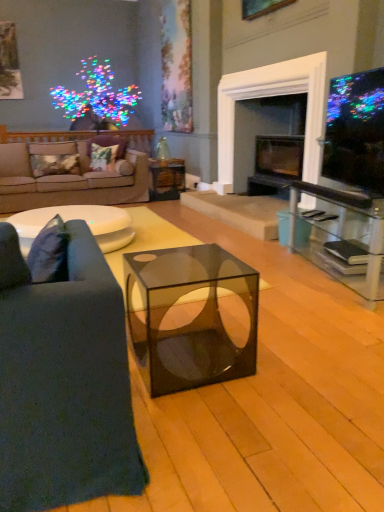
What is the approximate height of floral fabric pillow at center, the first pillow in the right-to-left sequence?

floral fabric pillow at center, the first pillow in the right-to-left sequence, is 14.15 inches in height.

How much space does floral fabric pillow at center, the first pillow in the right-to-left sequence, occupy horizontally?

It is 9.08 inches.

Describe the element at coordinates (269, 144) in the screenshot. I see `black glass fireplace at center` at that location.

Locate an element on the screen. Image resolution: width=384 pixels, height=512 pixels. metallic gold pillow at left, placed as the 3th pillow when sorted from right to left is located at coordinates (54, 159).

Where is `matte black tv at upper right`? matte black tv at upper right is located at coordinates (356, 131).

This screenshot has width=384, height=512. What do you see at coordinates (77, 219) in the screenshot? I see `white glossy coffee table at center` at bounding box center [77, 219].

I want to click on clear glass entertainment center at right, so point(337,234).

Where is `floral fabric pillow at center, the first pillow in the right-to-left sequence`? This screenshot has height=512, width=384. floral fabric pillow at center, the first pillow in the right-to-left sequence is located at coordinates (103, 157).

Visually, is dark blue fabric couch at left, the first studio couch from the right, positioned to the left or to the right of metallic gold pillow at left, placed as the 3th pillow when sorted from right to left?

In the image, dark blue fabric couch at left, the first studio couch from the right, appears on the right side of metallic gold pillow at left, placed as the 3th pillow when sorted from right to left.

Is dark blue fabric couch at left, marked as the 1th studio couch in a front-to-back arrangement, positioned in front of metallic gold pillow at left, placed as the first pillow when sorted from left to right?

Yes, dark blue fabric couch at left, marked as the 1th studio couch in a front-to-back arrangement, is closer to the viewer.

Which object is wider, dark blue fabric couch at left, the 2th studio couch when ordered from top to bottom, or metallic gold pillow at left, placed as the 3th pillow when sorted from right to left?

dark blue fabric couch at left, the 2th studio couch when ordered from top to bottom.

Is metallic gold pillow at left, placed as the 3th pillow when sorted from right to left, at the back of dark blue fabric couch at left, marked as the 1th studio couch in a front-to-back arrangement?

No, dark blue fabric couch at left, marked as the 1th studio couch in a front-to-back arrangement,'s orientation is not away from metallic gold pillow at left, placed as the 3th pillow when sorted from right to left.

Relative to transparent glass cube at center, is matte black tv at upper right in front or behind?

Visually, matte black tv at upper right is located behind transparent glass cube at center.

From the image's perspective, which is above, matte black tv at upper right or transparent glass cube at center?

matte black tv at upper right is shown above in the image.

Is matte black tv at upper right turned away from transparent glass cube at center?

No, matte black tv at upper right's orientation is not away from transparent glass cube at center.

How far apart are matte black tv at upper right and transparent glass cube at center?

A distance of 4.54 feet exists between matte black tv at upper right and transparent glass cube at center.

Is white glossy coffee table at center not within beige fabric couch at left, the 1th studio couch when ordered from top to bottom?

white glossy coffee table at center lies outside beige fabric couch at left, the 1th studio couch when ordered from top to bottom,'s area.

Is white glossy coffee table at center further to the viewer compared to beige fabric couch at left, which ranks as the first studio couch in back-to-front order?

That is False.

Does white glossy coffee table at center have a greater height compared to beige fabric couch at left, which is counted as the 1th studio couch, starting from the left?

In fact, white glossy coffee table at center may be shorter than beige fabric couch at left, which is counted as the 1th studio couch, starting from the left.

What are the coordinates of `table that is below the beige fabric couch at left, which ranks as the first studio couch in back-to-front order (from the image's perspective)` in the screenshot? It's located at (77, 219).

Can you tell me how much dark blue fabric couch at left, arranged as the 1th studio couch when ordered from the bottom, and matte black tv at upper right differ in facing direction?

76.2 degrees separate the facing orientations of dark blue fabric couch at left, arranged as the 1th studio couch when ordered from the bottom, and matte black tv at upper right.

Which of these two, dark blue fabric couch at left, marked as the 1th studio couch in a front-to-back arrangement, or matte black tv at upper right, stands shorter?

matte black tv at upper right.

From a real-world perspective, is dark blue fabric couch at left, the 2th studio couch when ordered from left to right, positioned above or below matte black tv at upper right?

dark blue fabric couch at left, the 2th studio couch when ordered from left to right, is below matte black tv at upper right.

From the image's perspective, who appears lower, dark blue fabric couch at left, the first studio couch from the right, or matte black tv at upper right?

From the image's view, dark blue fabric couch at left, the first studio couch from the right, is below.

I want to click on studio couch that is the 1st object to the left of the black glass fireplace at center, starting at the anchor, so tap(64, 383).

Between black glass fireplace at center and dark blue fabric couch at left, the first studio couch from the right, which one has more height?

Standing taller between the two is black glass fireplace at center.

Which is less distant, (255, 189) or (70, 430)?

The point (70, 430) is in front.

Is dark blue fabric couch at left, the 2th studio couch when ordered from top to bottom, completely or partially inside black glass fireplace at center?

No, dark blue fabric couch at left, the 2th studio couch when ordered from top to bottom, is not a part of black glass fireplace at center.

Considering the sizes of objects velvet floral pillow at center, positioned as the 2th pillow in right-to-left order, and translucent glass cube at center in the image provided, who is wider, velvet floral pillow at center, positioned as the 2th pillow in right-to-left order, or translucent glass cube at center?

translucent glass cube at center.

The height and width of the screenshot is (512, 384). What are the coordinates of `side table in front of the velvet floral pillow at center, which is the second pillow from left to right` in the screenshot? It's located at (166, 179).

Which is correct: velvet floral pillow at center, positioned as the 2th pillow in right-to-left order, is inside translucent glass cube at center, or outside of it?

velvet floral pillow at center, positioned as the 2th pillow in right-to-left order, is not inside translucent glass cube at center, it's outside.

Is velvet floral pillow at center, positioned as the 2th pillow in right-to-left order, shorter than translucent glass cube at center?

Correct, velvet floral pillow at center, positioned as the 2th pillow in right-to-left order, is not as tall as translucent glass cube at center.

Is the position of floral fabric pillow at center, the third pillow viewed from the left, less distant than that of translucent glass cube at center?

Yes, it is.

From the picture: How different are the orientations of floral fabric pillow at center, the third pillow viewed from the left, and translucent glass cube at center in degrees?

floral fabric pillow at center, the third pillow viewed from the left, and translucent glass cube at center are facing 44.6 degrees away from each other.

Starting from the translucent glass cube at center, which pillow is the 1st one in front? Please provide its 2D coordinates.

[(103, 157)]

Locate an element on the screen. Image resolution: width=384 pixels, height=512 pixels. the 2nd studio couch in front of the metallic gold pillow at left, placed as the first pillow when sorted from left to right, counting from the anchor's position is located at coordinates (64, 383).

Locate an element on the screen. This screenshot has height=512, width=384. coffee table that is under the matte black tv at upper right (from a real-world perspective) is located at coordinates (191, 316).

In the scene shown: Considering their positions, is beige fabric couch at left, the 1th studio couch when ordered from top to bottom, positioned further to translucent glass cube at center than white glossy coffee table at center?

white glossy coffee table at center.

Considering their positions, is dark blue fabric couch at left, the 2th studio couch when ordered from top to bottom, positioned further to matte black tv at upper right than velvet floral pillow at center, positioned as the 2th pillow in right-to-left order?

velvet floral pillow at center, positioned as the 2th pillow in right-to-left order, is further to matte black tv at upper right.

From the image, which object appears to be nearer to clear glass entertainment center at right, black glass fireplace at center or velvet floral pillow at center, which is the second pillow from left to right?

black glass fireplace at center is positioned closer to the anchor clear glass entertainment center at right.

Estimate the real-world distances between objects in this image. Which object is closer to matte black tv at upper right, transparent glass cube at center or floral fabric pillow at center, the first pillow in the right-to-left sequence?

The object closer to matte black tv at upper right is transparent glass cube at center.

When comparing their distances from white glossy coffee table at center, does floral fabric pillow at center, the third pillow viewed from the left, or beige fabric couch at left, arranged as the second studio couch when viewed from the right, seem closer?

beige fabric couch at left, arranged as the second studio couch when viewed from the right.

Looking at the image, which one is located further to dark blue fabric couch at left, the 2th studio couch when ordered from top to bottom, clear glass entertainment center at right or black glass fireplace at center?

black glass fireplace at center lies further to dark blue fabric couch at left, the 2th studio couch when ordered from top to bottom, than the other object.

Looking at the image, which one is located further to transparent glass cube at center, white glossy coffee table at center or black glass fireplace at center?

black glass fireplace at center is further to transparent glass cube at center.

When comparing their distances from velvet floral pillow at center, positioned as the 2th pillow in right-to-left order, does dark blue fabric couch at left, the 2th studio couch when ordered from back to front, or white glossy coffee table at center seem closer?

white glossy coffee table at center lies closer to velvet floral pillow at center, positioned as the 2th pillow in right-to-left order, than the other object.

Locate an element on the screen. The width and height of the screenshot is (384, 512). television between transparent glass cube at center and velvet floral pillow at center, positioned as the 2th pillow in right-to-left order, along the z-axis is located at coordinates (356, 131).

You are a GUI agent. You are given a task and a screenshot of the screen. Output one action in this format:
    pyautogui.click(x=<x>, y=<y>)
    Task: Click on the table located between transparent glass cube at center and floral fabric pillow at center, the first pillow in the right-to-left sequence, in the depth direction
    Image resolution: width=384 pixels, height=512 pixels.
    Given the screenshot: What is the action you would take?
    pyautogui.click(x=77, y=219)

Locate an element on the screen. coffee table between dark blue fabric couch at left, the 2th studio couch when ordered from left to right, and metallic gold pillow at left, placed as the first pillow when sorted from left to right, from front to back is located at coordinates (191, 316).

Where is `entertainment center between matte black tv at upper right and metallic gold pillow at left, placed as the 3th pillow when sorted from right to left, from front to back`? entertainment center between matte black tv at upper right and metallic gold pillow at left, placed as the 3th pillow when sorted from right to left, from front to back is located at coordinates (337, 234).